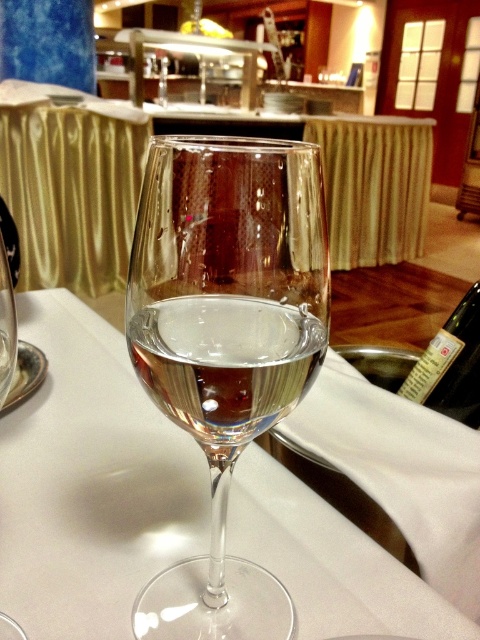
Question: Does transparent glass at center appear on the right side of clear glass wine at center?

Choices:
 (A) yes
 (B) no

Answer: (B)

Question: From the image, what is the correct spatial relationship of clear glass wine glass at center in relation to green glass bottle at lower right?

Choices:
 (A) above
 (B) below

Answer: (B)

Question: Does transparent glass at center lie behind clear glass wine at center?

Choices:
 (A) yes
 (B) no

Answer: (A)

Question: Estimate the real-world distances between objects in this image. Which object is farther from the clear glass wine glass at center?

Choices:
 (A) clear glass wine at center
 (B) transparent glass at center
 (C) green glass bottle at lower right

Answer: (C)

Question: Among these objects, which one is farthest from the camera?

Choices:
 (A) clear glass wine glass at center
 (B) transparent glass at center
 (C) green glass bottle at lower right
 (D) clear glass wine at center

Answer: (C)

Question: Which point is farther to the camera?

Choices:
 (A) clear glass wine glass at center
 (B) clear glass wine at center

Answer: (B)